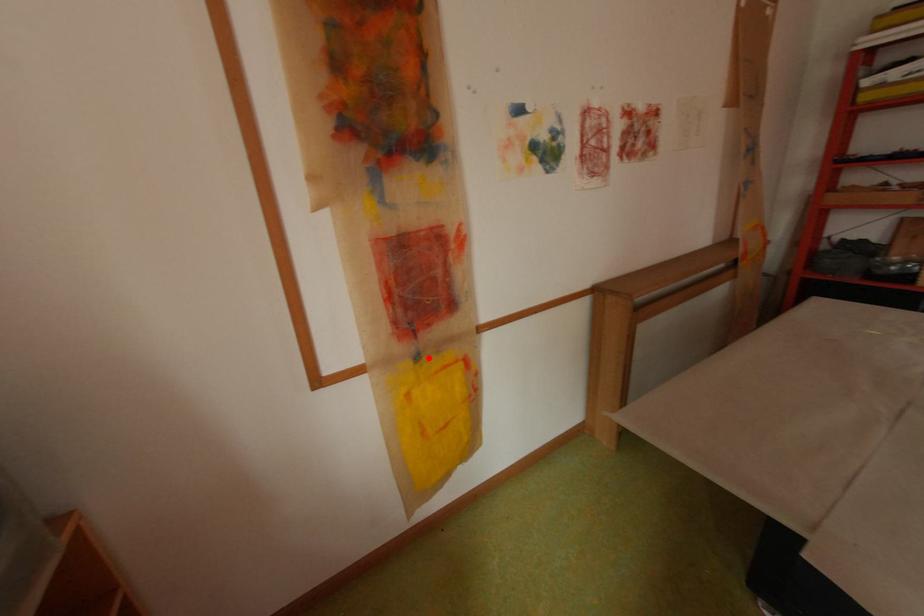
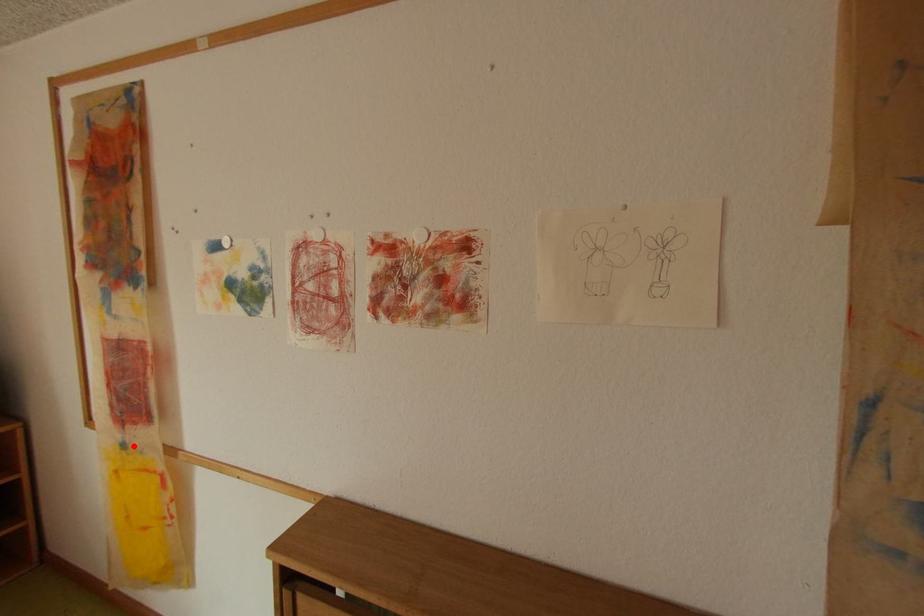
I am providing you with two images of the same scene from different viewpoints. A red point is marked on the first image and another point is marked on the second image. Does the point marked in image1 correspond to the same location as the one in image2?

Yes